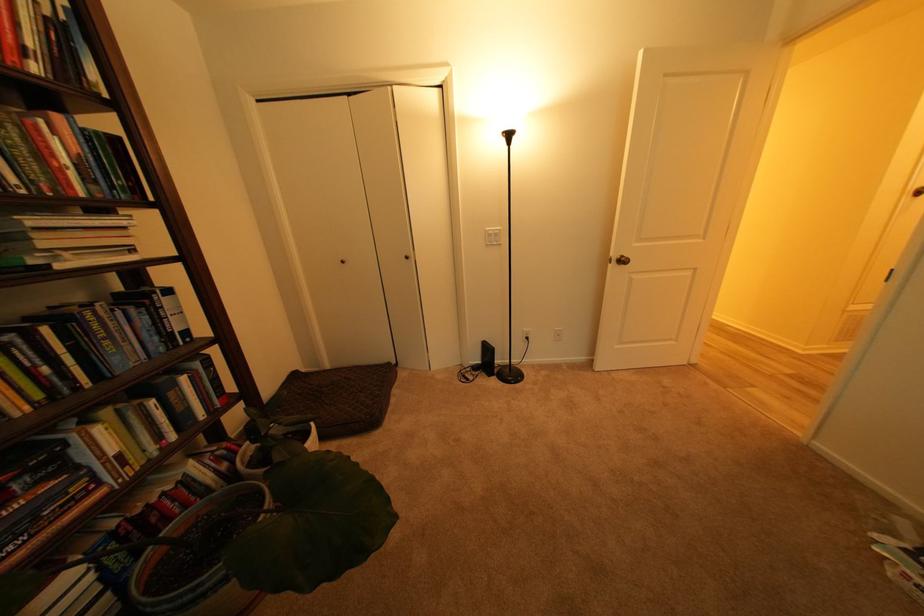
I want to click on brass door handle, so click(x=622, y=259).